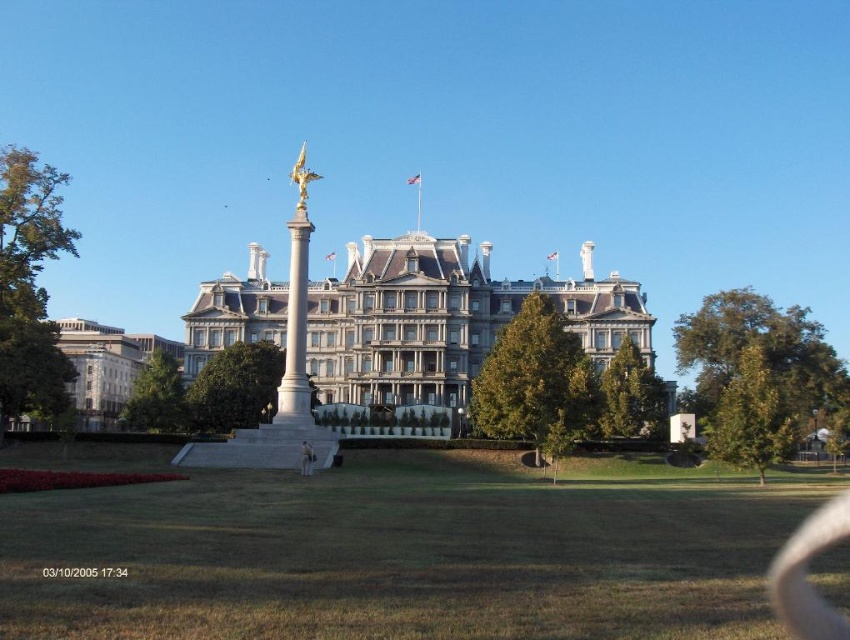
Can you confirm if white stone palace at center is taller than white marble column at center?

No.

Is white stone palace at center smaller than white marble column at center?

No, white stone palace at center is not smaller than white marble column at center.

Who is more forward, (x=332, y=317) or (x=293, y=401)?

Point (x=293, y=401) is more forward.

Where is `white stone palace at center`? The image size is (850, 640). white stone palace at center is located at coordinates (445, 317).

Does point (561, 589) come behind point (306, 262)?

No, (561, 589) is in front of (306, 262).

Measure the distance between green grass at center and white marble column at center.

green grass at center is 92.49 feet away from white marble column at center.

Is point (387, 621) positioned in front of point (293, 227)?

Yes, point (387, 621) is closer to viewer.

Find the location of `green grass at center`. green grass at center is located at coordinates (400, 556).

Can you confirm if green grass at center is taller than white stone palace at center?

No.

Does point (332, 509) come farther from viewer compared to point (388, 241)?

No, (332, 509) is in front of (388, 241).

The width and height of the screenshot is (850, 640). What are the coordinates of `green grass at center` in the screenshot? It's located at (400, 556).